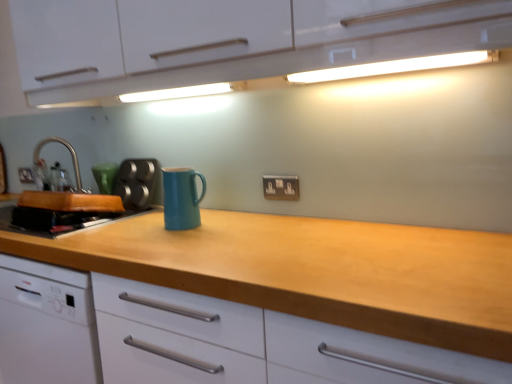
The width and height of the screenshot is (512, 384). Identify the location of vacant space to the right of teal matte mug at center, the second kitchen appliance in the left-to-right sequence. (216, 219).